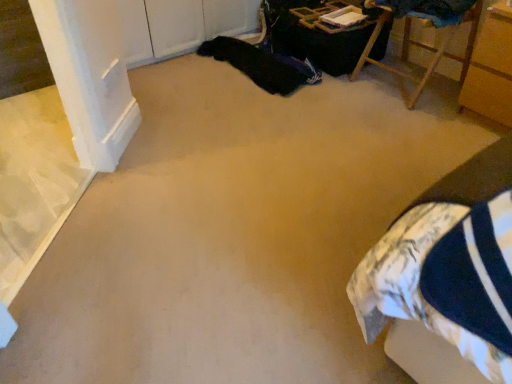
Question: From a real-world perspective, is wooden cabinet at right, which is counted as the 2th furniture, starting from the left, located higher than wooden chair at upper right, which is the first furniture in left-to-right order?

Choices:
 (A) yes
 (B) no

Answer: (B)

Question: From the image's perspective, is wooden cabinet at right, the 1th furniture in the right-to-left sequence, located above wooden chair at upper right, the second furniture in the right-to-left sequence?

Choices:
 (A) no
 (B) yes

Answer: (A)

Question: Is wooden cabinet at right, the 1th furniture in the right-to-left sequence, oriented towards wooden chair at upper right, the second furniture in the right-to-left sequence?

Choices:
 (A) yes
 (B) no

Answer: (B)

Question: From the image's perspective, is wooden cabinet at right, the 1th furniture in the right-to-left sequence, beneath wooden chair at upper right, which is the first furniture in left-to-right order?

Choices:
 (A) no
 (B) yes

Answer: (B)

Question: Is wooden cabinet at right, which is counted as the 2th furniture, starting from the left, looking in the opposite direction of wooden chair at upper right, which is the first furniture in left-to-right order?

Choices:
 (A) no
 (B) yes

Answer: (A)

Question: Considering the relative positions of wooden cabinet at right, which is counted as the 2th furniture, starting from the left, and wooden chair at upper right, which is the first furniture in left-to-right order, in the image provided, is wooden cabinet at right, which is counted as the 2th furniture, starting from the left, to the right of wooden chair at upper right, which is the first furniture in left-to-right order, from the viewer's perspective?

Choices:
 (A) no
 (B) yes

Answer: (B)

Question: Considering the relative sizes of wooden chair at upper right, the second furniture in the right-to-left sequence, and black fabric at upper center in the image provided, is wooden chair at upper right, the second furniture in the right-to-left sequence, shorter than black fabric at upper center?

Choices:
 (A) yes
 (B) no

Answer: (B)

Question: Is the position of wooden chair at upper right, which is the first furniture in left-to-right order, more distant than that of black fabric at upper center?

Choices:
 (A) yes
 (B) no

Answer: (B)

Question: Is wooden chair at upper right, the second furniture in the right-to-left sequence, aimed at black fabric at upper center?

Choices:
 (A) no
 (B) yes

Answer: (A)

Question: Is black fabric at upper center completely or partially inside wooden chair at upper right, which is the first furniture in left-to-right order?

Choices:
 (A) no
 (B) yes

Answer: (A)

Question: Considering the relative sizes of wooden chair at upper right, which is the first furniture in left-to-right order, and black fabric at upper center in the image provided, is wooden chair at upper right, which is the first furniture in left-to-right order, bigger than black fabric at upper center?

Choices:
 (A) yes
 (B) no

Answer: (A)

Question: Is wooden chair at upper right, the second furniture in the right-to-left sequence, positioned in front of black fabric at upper center?

Choices:
 (A) yes
 (B) no

Answer: (A)

Question: Can you confirm if black fabric at upper center is thinner than wooden cabinet at right, which is counted as the 2th furniture, starting from the left?

Choices:
 (A) yes
 (B) no

Answer: (B)